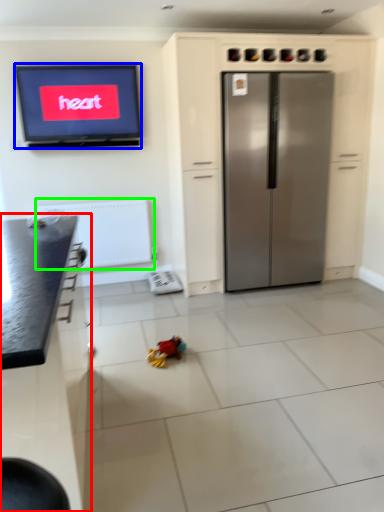
Question: Estimate the real-world distances between objects in this image. Which object is farther from cabinetry (highlighted by a red box), television (highlighted by a blue box) or radiator (highlighted by a green box)?

Choices:
 (A) television
 (B) radiator

Answer: (A)